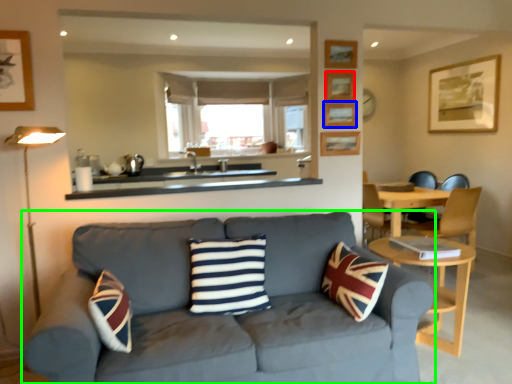
Question: Based on their relative distances, which object is farther from picture frame (highlighted by a red box)? Choose from picture frame (highlighted by a blue box) and studio couch (highlighted by a green box).

Choices:
 (A) picture frame
 (B) studio couch

Answer: (B)